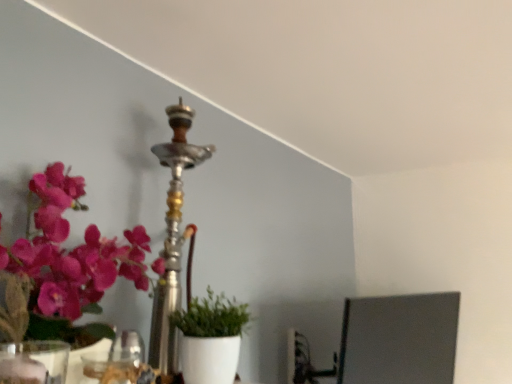
Question: From a real-world perspective, is green matte plant at center under silver metallic hookah at center?

Choices:
 (A) no
 (B) yes

Answer: (B)

Question: Can you confirm if green matte plant at center is positioned to the left of silver metallic hookah at center?

Choices:
 (A) no
 (B) yes

Answer: (A)

Question: Is green matte plant at center oriented away from silver metallic hookah at center?

Choices:
 (A) yes
 (B) no

Answer: (A)

Question: From a real-world perspective, is green matte plant at center over silver metallic hookah at center?

Choices:
 (A) yes
 (B) no

Answer: (B)

Question: Is the position of green matte plant at center less distant than that of silver metallic hookah at center?

Choices:
 (A) yes
 (B) no

Answer: (A)

Question: Can you confirm if green matte plant at center is taller than silver metallic hookah at center?

Choices:
 (A) no
 (B) yes

Answer: (A)

Question: Is metallic pink flowers at left taller than silver metallic hookah at center?

Choices:
 (A) yes
 (B) no

Answer: (B)

Question: Is metallic pink flowers at left placed right next to silver metallic hookah at center?

Choices:
 (A) no
 (B) yes

Answer: (A)

Question: Can you confirm if metallic pink flowers at left is thinner than silver metallic hookah at center?

Choices:
 (A) no
 (B) yes

Answer: (B)

Question: Considering the relative positions of metallic pink flowers at left and silver metallic hookah at center in the image provided, is metallic pink flowers at left to the right of silver metallic hookah at center from the viewer's perspective?

Choices:
 (A) no
 (B) yes

Answer: (A)

Question: Is metallic pink flowers at left oriented towards silver metallic hookah at center?

Choices:
 (A) yes
 (B) no

Answer: (B)

Question: Would you say metallic pink flowers at left contains silver metallic hookah at center?

Choices:
 (A) no
 (B) yes

Answer: (A)

Question: From the image's perspective, would you say transparent glass vase at lower left is positioned over green matte plant at center?

Choices:
 (A) no
 (B) yes

Answer: (B)